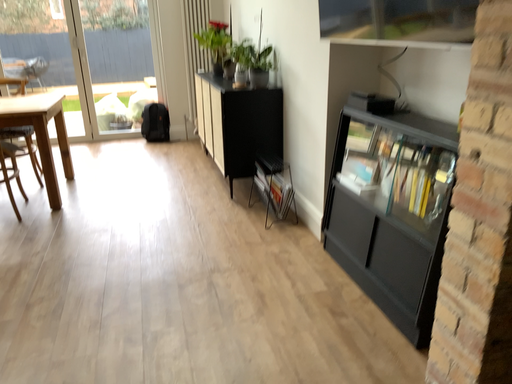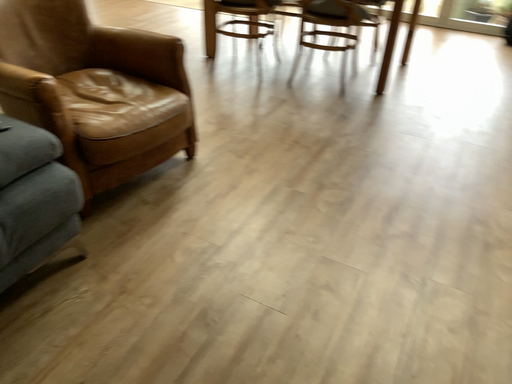
Question: Which way did the camera rotate in the video?

Choices:
 (A) rotated left
 (B) rotated right

Answer: (A)